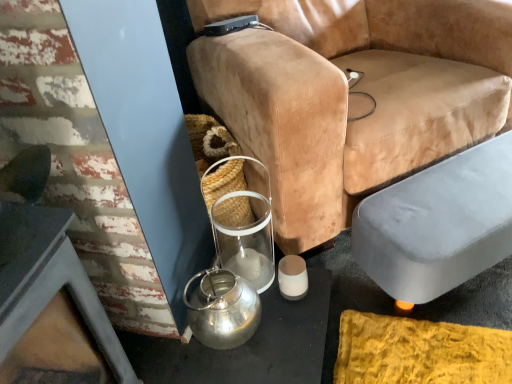
Question: Based on their sizes in the image, would you say gray fabric ottoman at lower right is bigger or smaller than shiny metallic kettle at lower left?

Choices:
 (A) big
 (B) small

Answer: (A)

Question: From a real-world perspective, is gray fabric ottoman at lower right positioned above or below shiny metallic kettle at lower left?

Choices:
 (A) above
 (B) below

Answer: (B)

Question: Estimate the real-world distances between objects in this image. Which object is closer to the matte white candle at lower center?

Choices:
 (A) velvet tan chair at center
 (B) gray fabric ottoman at lower right
 (C) shiny metallic kettle at lower left

Answer: (C)

Question: Considering the real-world distances, which object is closest to the velvet tan chair at center?

Choices:
 (A) matte white candle at lower center
 (B) shiny metallic kettle at lower left
 (C) gray fabric ottoman at lower right

Answer: (C)